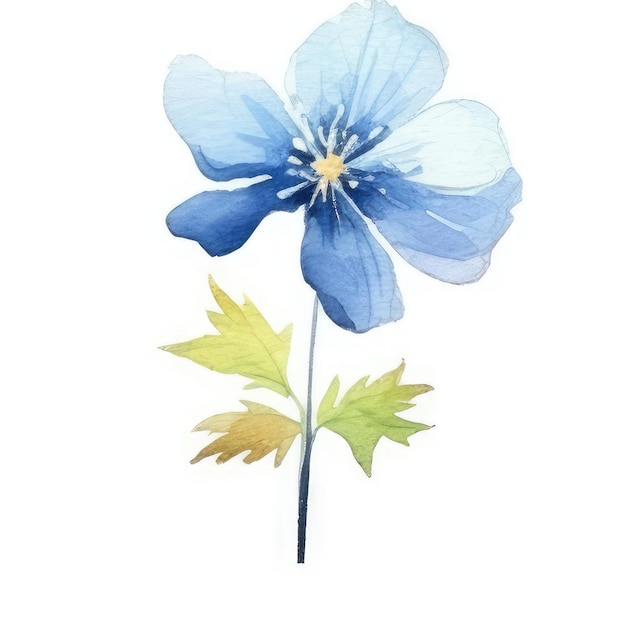
At what (x,y) coordinates should I click in order to perform the action: click on painting. Please return your answer as a coordinate pair (x, y). Looking at the image, I should click on (441, 171).